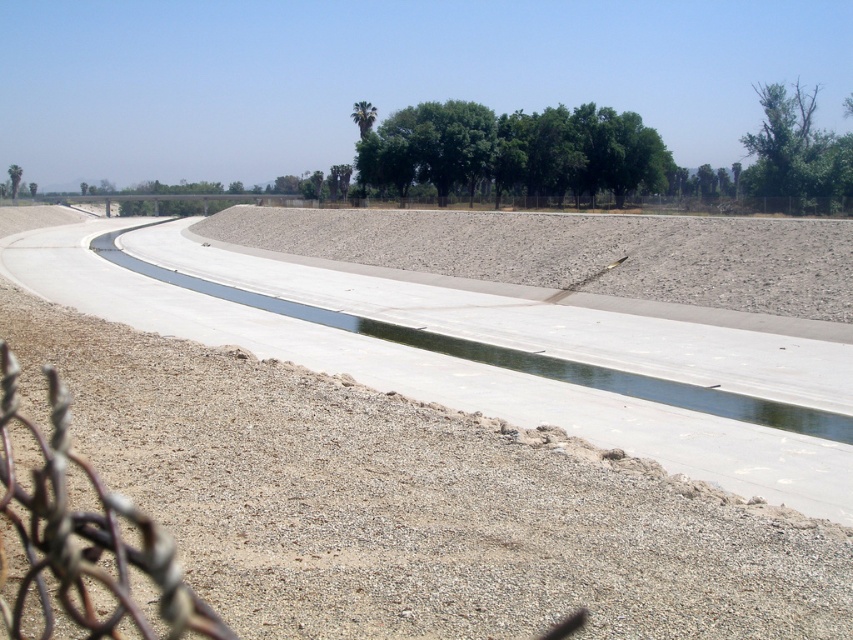
Question: Can you confirm if green leafy trees at center is positioned to the right of green leafy tree at upper center?

Choices:
 (A) no
 (B) yes

Answer: (B)

Question: Which point is closer to the camera taking this photo?

Choices:
 (A) (805, 170)
 (B) (477, 440)

Answer: (B)

Question: Does gray gravel dirt field at center have a greater width compared to green leafy trees at center?

Choices:
 (A) yes
 (B) no

Answer: (B)

Question: Does green leafy trees at center appear over green leafy tree at upper right?

Choices:
 (A) yes
 (B) no

Answer: (A)

Question: Estimate the real-world distances between objects in this image. Which object is farther from the green leafy tree at upper right?

Choices:
 (A) green leafy tree at upper center
 (B) green leafy trees at center

Answer: (A)

Question: Which point is closer to the camera?

Choices:
 (A) (762, 157)
 (B) (71, 324)

Answer: (B)